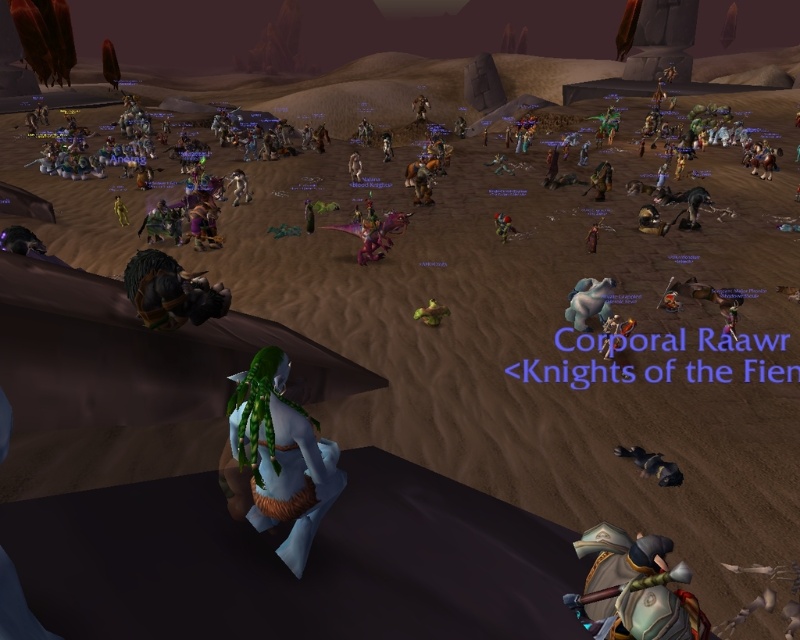
Question: Which point is farther to the camera?

Choices:
 (A) shiny silver armor at lower right
 (B) dark gray fur at lower right

Answer: (B)

Question: Can you confirm if green fabric bag at center is positioned to the right of shiny metallic armor at center?

Choices:
 (A) yes
 (B) no

Answer: (A)

Question: Observing the image, what is the correct spatial positioning of green leather armor at center in reference to metallic armor at center?

Choices:
 (A) below
 (B) above

Answer: (B)

Question: Estimate the real-world distances between objects in this image. Which object is farther from the green leather armor at center?

Choices:
 (A) light blue fabric at center
 (B) green fur at left
 (C) shiny silver armor at lower right

Answer: (C)

Question: Observing the image, what is the correct spatial positioning of shiny silver armor at lower right in reference to green fabric dragon at center?

Choices:
 (A) above
 (B) below

Answer: (B)

Question: Which point is farther from the camera taking this photo?

Choices:
 (A) (308, 198)
 (B) (386, 131)

Answer: (B)